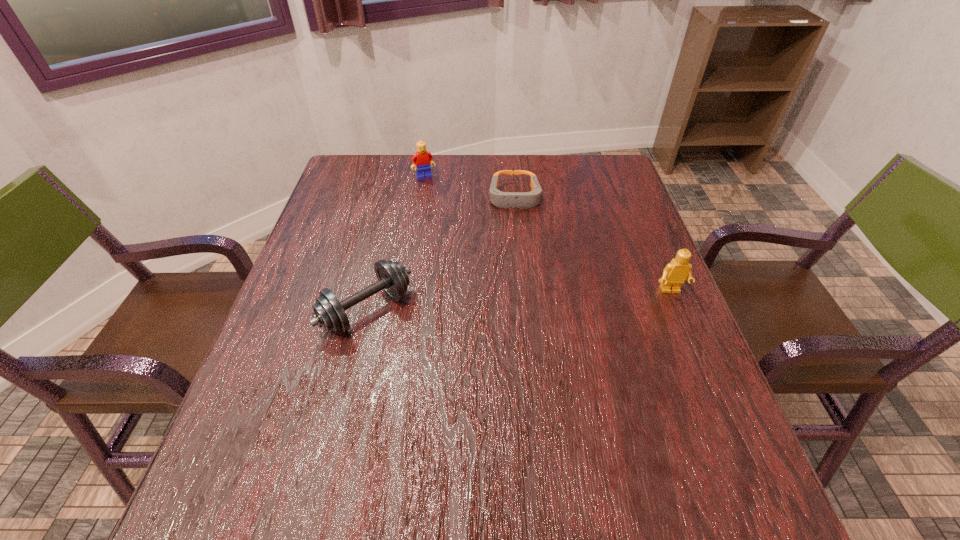
Locate an element on the screen. vacant space situated 0.310m on the front and back of the second object from right to left is located at coordinates (523, 295).

This screenshot has width=960, height=540. Identify the location of vacant area situated 0.240m on the front and back of the second object from right to left. (521, 274).

In order to click on free spot located 0.200m on the face of the left Lego in this screenshot , I will do `click(446, 217)`.

This screenshot has width=960, height=540. I want to click on free spot located on the face of the left Lego, so click(456, 236).

You are a GUI agent. You are given a task and a screenshot of the screen. Output one action in this format:
    pyautogui.click(x=<x>, y=<y>)
    Task: Click on the vacant space located 0.380m on the face of the left Lego
    Image resolution: width=960 pixels, height=540 pixels.
    Given the screenshot: What is the action you would take?
    pyautogui.click(x=467, y=258)

Where is `goggles present at the far edge`? This screenshot has height=540, width=960. goggles present at the far edge is located at coordinates (522, 200).

The height and width of the screenshot is (540, 960). I want to click on Lego located at the far edge, so click(x=422, y=158).

At what (x,y) coordinates should I click in order to perform the action: click on object present at the left edge. Please return your answer as a coordinate pair (x, y). The width and height of the screenshot is (960, 540). Looking at the image, I should click on click(x=329, y=313).

Identify the location of object present at the right edge. (678, 270).

This screenshot has width=960, height=540. I want to click on vacant space at the far edge of the desktop, so click(559, 165).